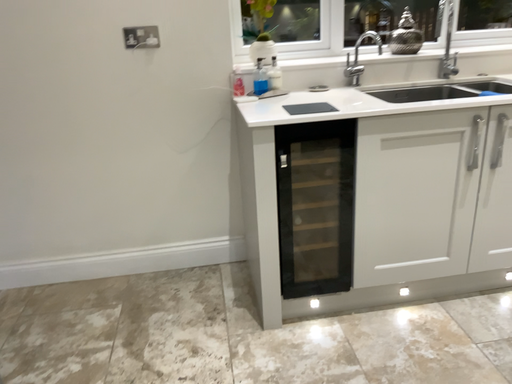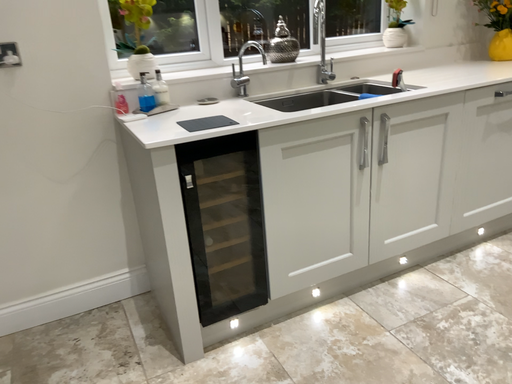
Question: Which way did the camera rotate in the video?

Choices:
 (A) rotated right
 (B) rotated left

Answer: (A)